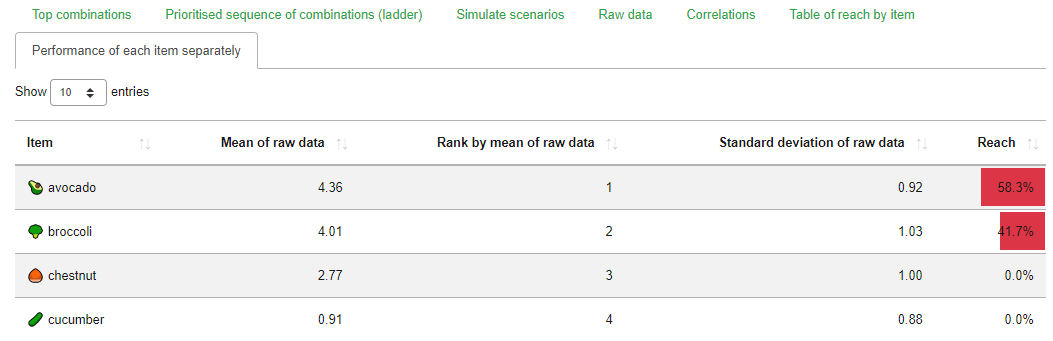
Where is `ladder`? This screenshot has height=341, width=1053. ladder is located at coordinates (381, 95).